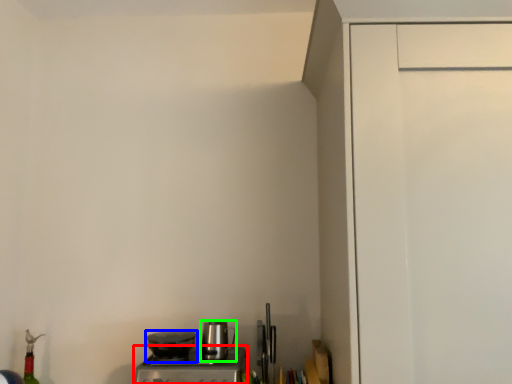
Question: Considering the real-world distances, which object is farthest from home appliance (highlighted by a red box)? kitchen appliance (highlighted by a blue box) or kitchen appliance (highlighted by a green box)?

Choices:
 (A) kitchen appliance
 (B) kitchen appliance

Answer: (B)